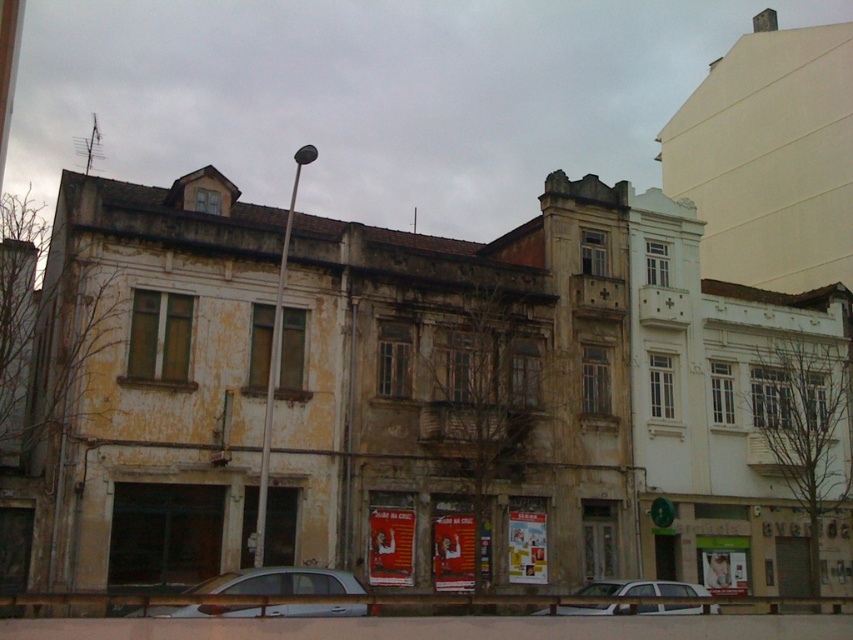
Which is behind, point (207, 604) or point (717, 604)?

The point (717, 604) is more distant.

Does silver metallic sedan at center come in front of white matte car at center?

Yes, it is.

I want to click on silver metallic sedan at center, so click(x=280, y=582).

Where is `silver metallic sedan at center`? The width and height of the screenshot is (853, 640). silver metallic sedan at center is located at coordinates (280, 582).